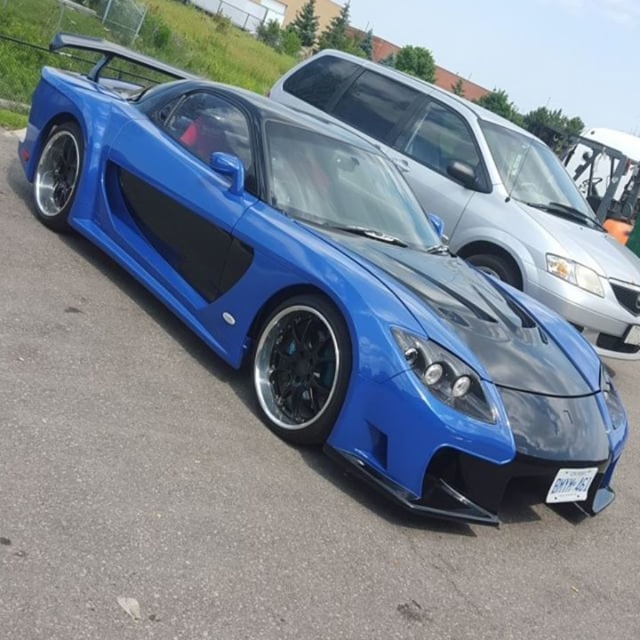
The height and width of the screenshot is (640, 640). What do you see at coordinates (484, 189) in the screenshot?
I see `glossy blue sports car at center` at bounding box center [484, 189].

Consider the image. Is glossy blue sports car at center to the right of white plastic license plate at lower center from the viewer's perspective?

Correct, you'll find glossy blue sports car at center to the right of white plastic license plate at lower center.

Is point (557, 168) in front of point (580, 474)?

No, it is not.

Where is `glossy blue sports car at center`? glossy blue sports car at center is located at coordinates (484, 189).

Between shiny blue sports car at center and white plastic license plate at lower center, which one has less height?

With less height is white plastic license plate at lower center.

Which is behind, point (140, 125) or point (573, 481)?

The point (140, 125) is behind.

Where is `shiny blue sports car at center`? Image resolution: width=640 pixels, height=640 pixels. shiny blue sports car at center is located at coordinates (321, 284).

Is shiny blue sports car at center smaller than glossy blue sports car at center?

No, shiny blue sports car at center is not smaller than glossy blue sports car at center.

Who is positioned more to the right, shiny blue sports car at center or glossy blue sports car at center?

Positioned to the right is glossy blue sports car at center.

Which is behind, point (80, 189) or point (426, 144)?

Point (426, 144)

Identify the location of shiny blue sports car at center. (321, 284).